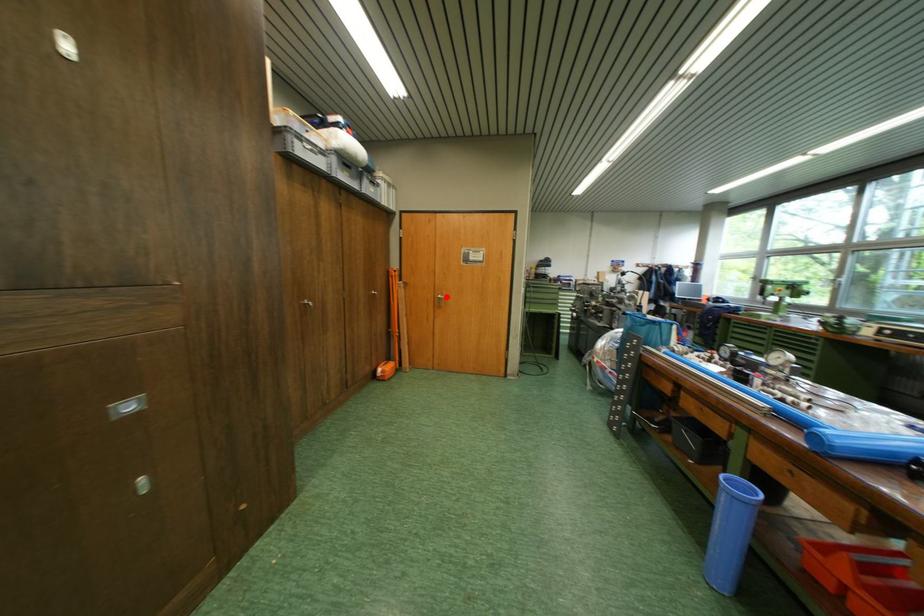
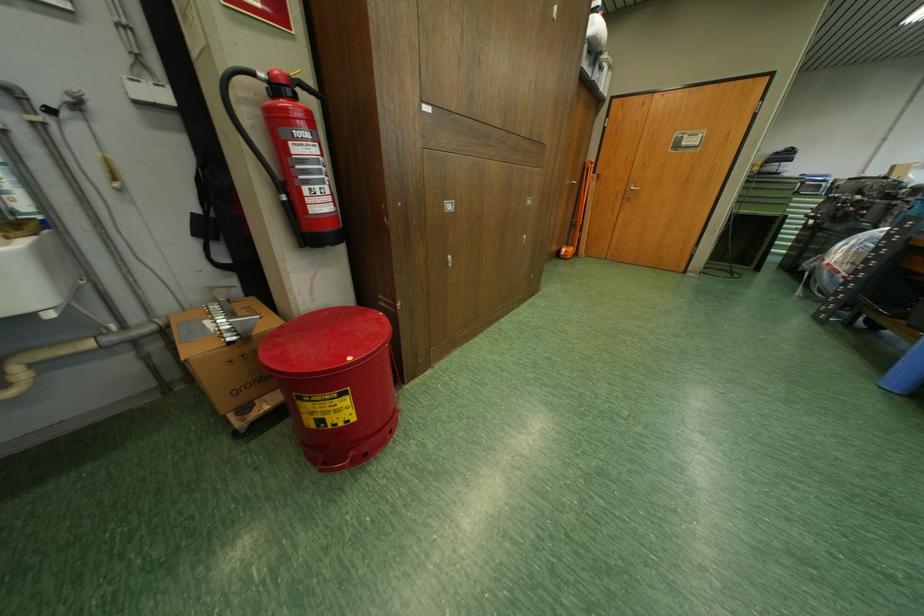
In the second image, find the point that corresponds to the highlighted location in the first image.

(638, 188)